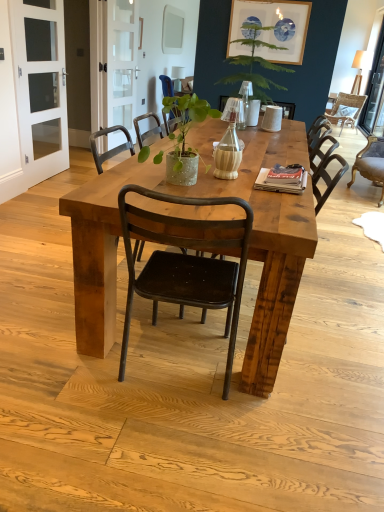
At what (x,y) coordinates should I click in order to perform the action: click on matte beige cup at center. Please return your answer as a coordinate pair (x, y). Looking at the image, I should click on (272, 119).

What do you see at coordinates (272, 119) in the screenshot?
I see `matte beige cup at center` at bounding box center [272, 119].

What do you see at coordinates (245, 102) in the screenshot? The width and height of the screenshot is (384, 512). I see `clear glass vase at center` at bounding box center [245, 102].

The width and height of the screenshot is (384, 512). What do you see at coordinates (346, 109) in the screenshot?
I see `woven rattan chair at upper right, marked as the first chair in a top-to-bottom arrangement` at bounding box center [346, 109].

Find the location of a particular element. This screenshot has height=512, width=384. brown leather chair at right, the 3th chair in the top-to-bottom sequence is located at coordinates (371, 164).

Locate an element on the screen. This screenshot has width=384, height=512. the 1st chair positioned below the speckled concrete pot at center, which is the 1th houseplant from left to right (from a real-world perspective) is located at coordinates (186, 261).

Is rustic wood chair at center, arranged as the second chair when viewed from the left, located within speckled concrete pot at center, which ranks as the 2th houseplant in right-to-left order?

No, rustic wood chair at center, arranged as the second chair when viewed from the left, is not a part of speckled concrete pot at center, which ranks as the 2th houseplant in right-to-left order.

Can you confirm if speckled concrete pot at center, arranged as the second houseplant when viewed from the top, is bigger than rustic wood chair at center, arranged as the second chair when viewed from the left?

Incorrect, speckled concrete pot at center, arranged as the second houseplant when viewed from the top, is not larger than rustic wood chair at center, arranged as the second chair when viewed from the left.

From a real-world perspective, is speckled concrete pot at center, which is the 1th houseplant from left to right, physically above rustic wood chair at center, the 4th chair viewed from the back?

Yes.

Is brown leather chair at right, placed as the third chair when sorted from left to right, not near rustic wood table at center?

brown leather chair at right, placed as the third chair when sorted from left to right, is positioned a significant distance from rustic wood table at center.

Considering the sizes of brown leather chair at right, the 2th chair from the front, and rustic wood table at center in the image, is brown leather chair at right, the 2th chair from the front, taller or shorter than rustic wood table at center?

Considering their sizes, brown leather chair at right, the 2th chair from the front, has more height than rustic wood table at center.

From a real-world perspective, is brown leather chair at right, the 2th chair from the front, over rustic wood table at center?

Correct, in the physical world, brown leather chair at right, the 2th chair from the front, is higher than rustic wood table at center.

Is brown leather chair at right, the 3th chair in the top-to-bottom sequence, thinner than rustic wood table at center?

Yes, brown leather chair at right, the 3th chair in the top-to-bottom sequence, is thinner than rustic wood table at center.

Between woven rattan chair at upper right, marked as the first chair in a top-to-bottom arrangement, and green leafy plant at upper center, arranged as the 2th houseplant when ordered from the bottom, which one is positioned in front?

green leafy plant at upper center, arranged as the 2th houseplant when ordered from the bottom, is closer to the camera.

Is woven rattan chair at upper right, the 4th chair viewed from the front, not within green leafy plant at upper center, the first houseplant when ordered from top to bottom?

Yes, woven rattan chair at upper right, the 4th chair viewed from the front, is outside of green leafy plant at upper center, the first houseplant when ordered from top to bottom.

Based on the photo, how many degrees apart are the facing directions of woven rattan chair at upper right, marked as the first chair in a top-to-bottom arrangement, and green leafy plant at upper center, which ranks as the 2th houseplant in front-to-back order?

woven rattan chair at upper right, marked as the first chair in a top-to-bottom arrangement, and green leafy plant at upper center, which ranks as the 2th houseplant in front-to-back order, are facing 34.7 degrees away from each other.

Which is more to the left, woven rattan chair at upper right, the first chair when ordered from back to front, or green leafy plant at upper center, arranged as the 2th houseplant when ordered from the bottom?

green leafy plant at upper center, arranged as the 2th houseplant when ordered from the bottom.

Could you tell me if woven rattan chair at upper right, the 4th chair in the bottom-to-top sequence, is turned towards white glass screen door at left, the 1th screen door in the left-to-right sequence?

Yes, woven rattan chair at upper right, the 4th chair in the bottom-to-top sequence, is oriented towards white glass screen door at left, the 1th screen door in the left-to-right sequence.

Based on the photo, can you confirm if woven rattan chair at upper right, the 4th chair viewed from the front, is positioned to the left of white glass screen door at left, the first screen door from the front?

No.

Between woven rattan chair at upper right, marked as the first chair in a top-to-bottom arrangement, and white glass screen door at left, arranged as the 2th screen door when viewed from the back, which one has larger size?

With larger size is woven rattan chair at upper right, marked as the first chair in a top-to-bottom arrangement.

From a real-world perspective, is woven rattan chair at upper right, the 4th chair viewed from the front, under white glass screen door at left, arranged as the 2th screen door when viewed from the back?

Indeed, from a real-world perspective, woven rattan chair at upper right, the 4th chair viewed from the front, is positioned beneath white glass screen door at left, arranged as the 2th screen door when viewed from the back.

From the matte blue and white circular prints at upper center, count the 1st houseplant to the left and point to it. Please provide its 2D coordinates.

[(258, 60)]

From a real-world perspective, which is physically below, matte blue and white circular prints at upper center or green leafy plant at upper center, which ranks as the first houseplant in back-to-front order?

green leafy plant at upper center, which ranks as the first houseplant in back-to-front order, from a real-world perspective.

Is matte blue and white circular prints at upper center spatially inside green leafy plant at upper center, arranged as the 1th houseplant when viewed from the right, or outside of it?

matte blue and white circular prints at upper center exists outside the volume of green leafy plant at upper center, arranged as the 1th houseplant when viewed from the right.

Choose the correct answer: Is clear glass vase at center inside woven rattan chair at upper right, marked as the first chair in a top-to-bottom arrangement, or outside it?

clear glass vase at center is located beyond the bounds of woven rattan chair at upper right, marked as the first chair in a top-to-bottom arrangement.

How far apart are clear glass vase at center and woven rattan chair at upper right, acting as the fourth chair starting from the left?

6.62 feet.

Considering the relative positions of clear glass vase at center and woven rattan chair at upper right, the 4th chair viewed from the front, in the image provided, is clear glass vase at center to the left or to the right of woven rattan chair at upper right, the 4th chair viewed from the front,?

Clearly, clear glass vase at center is on the left of woven rattan chair at upper right, the 4th chair viewed from the front, in the image.

At what (x,y) coordinates should I click in order to perform the action: click on lamp above the woven rattan chair at upper right, the 4th chair viewed from the front (from a real-world perspective). Please return your answer as a coordinate pair (x, y). Looking at the image, I should click on (245, 102).

From a real-world perspective, which is physically below, brown leather chair at right, the 2th chair from the front, or matte beige cup at center?

In real-world perspective, brown leather chair at right, the 2th chair from the front, is lower.

From their relative heights in the image, would you say brown leather chair at right, the 3th chair in the top-to-bottom sequence, is taller or shorter than matte beige cup at center?

brown leather chair at right, the 3th chair in the top-to-bottom sequence, is taller than matte beige cup at center.

Is brown leather chair at right, placed as the third chair when sorted from left to right, further to camera compared to matte beige cup at center?

That is True.

How distant is brown leather chair at right, the 2th chair from the front, from matte beige cup at center?

brown leather chair at right, the 2th chair from the front, and matte beige cup at center are 1.68 meters apart.

Image resolution: width=384 pixels, height=512 pixels. I want to click on the 1st houseplant located above the rustic wood chair at center, which appears as the 4th chair when viewed from the top (from a real-world perspective), so click(x=185, y=134).

Identify the location of desk in front of the brown leather chair at right, the 2th chair from the front. (200, 196).

Considering their positions, is white matte picture frame at upper center positioned closer to clear glass vase at center than rustic wood table at center?

Among the two, rustic wood table at center is located nearer to clear glass vase at center.

Considering their positions, is brown leather chair at right, placed as the third chair when sorted from left to right, positioned closer to white glass screen door at left, the first screen door from the front, than translucent wood bottle at center?

translucent wood bottle at center is closer to white glass screen door at left, the first screen door from the front.

Estimate the real-world distances between objects in this image. Which object is further from rustic wood chair at center, positioned as the third chair in right-to-left order, green leafy plant at upper center, the second houseplant positioned from the left, or metallic black chair at center, the first chair in the left-to-right sequence?

Based on the image, green leafy plant at upper center, the second houseplant positioned from the left, appears to be further to rustic wood chair at center, positioned as the third chair in right-to-left order.

When comparing their distances from brown leather chair at right, placed as the third chair when sorted from left to right, does clear glass door at upper center, marked as the 2th screen door in a front-to-back arrangement, or matte beige cup at center seem closer?

matte beige cup at center is positioned closer to the anchor brown leather chair at right, placed as the third chair when sorted from left to right.

When comparing their distances from white matte picture frame at upper center, does green leafy plant at upper center, which ranks as the 2th houseplant in front-to-back order, or matte blue and white circular prints at upper center seem further?

Based on the image, matte blue and white circular prints at upper center appears to be further to white matte picture frame at upper center.

Based on their spatial positions, is clear glass vase at center or brown leather chair at right, placed as the third chair when sorted from left to right, closer to white matte picture frame at upper center?

clear glass vase at center is closer to white matte picture frame at upper center.

Looking at the image, which one is located closer to matte beige cup at center, brown leather chair at right, the 2th chair from the front, or speckled concrete pot at center, which is the 1th houseplant from left to right?

Based on the image, speckled concrete pot at center, which is the 1th houseplant from left to right, appears to be nearer to matte beige cup at center.

From the image, which object appears to be farther from rustic wood chair at center, the 1th chair from the bottom, white matte picture frame at upper center or matte blue and white circular prints at upper center?

Answer: The object further to rustic wood chair at center, the 1th chair from the bottom, is white matte picture frame at upper center.

Where is `coffee cup positioned between rustic wood table at center and brown leather chair at right, the second chair positioned from the bottom, from near to far`? Image resolution: width=384 pixels, height=512 pixels. coffee cup positioned between rustic wood table at center and brown leather chair at right, the second chair positioned from the bottom, from near to far is located at coordinates (272, 119).

Locate an element on the screen. Image resolution: width=384 pixels, height=512 pixels. screen door located between rustic wood chair at center, which is counted as the 1th chair, starting from the front, and clear glass door at upper center, marked as the first screen door in a right-to-left arrangement, in the depth direction is located at coordinates (40, 86).

I want to click on coffee cup between speckled concrete pot at center, which ranks as the 2th houseplant in right-to-left order, and metallic black chair at center, the 4th chair positioned from the right, along the z-axis, so click(x=272, y=119).

Locate an element on the screen. The image size is (384, 512). houseplant between speckled concrete pot at center, the 1th houseplant when ordered from front to back, and white matte picture frame at upper center in the front-back direction is located at coordinates (258, 60).